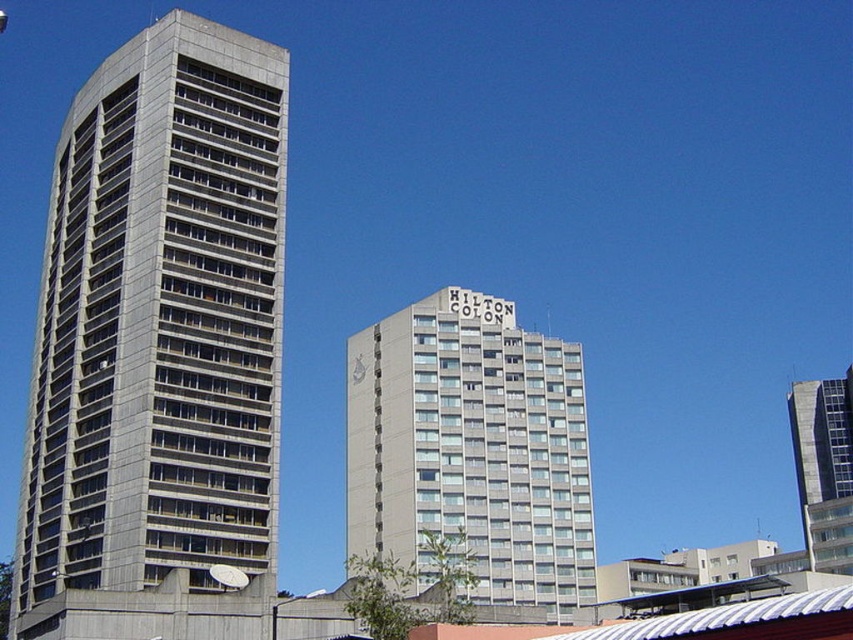
Can you confirm if gray metallic building at left is positioned to the right of gray concrete building at center?

In fact, gray metallic building at left is to the left of gray concrete building at center.

Is point (80, 525) positioned before point (410, 387)?

Yes, it is.

I want to click on gray metallic building at left, so click(x=160, y=321).

Which is more to the left, gray concrete building at center or gray concrete building at right?

gray concrete building at center

Is gray concrete building at center wider than gray concrete building at right?

No.

Is point (422, 492) farther from camera compared to point (816, 536)?

No, (422, 492) is closer to viewer.

You are a GUI agent. You are given a task and a screenshot of the screen. Output one action in this format:
    pyautogui.click(x=<x>, y=<y>)
    Task: Click on the gray concrete building at center
    Image resolution: width=853 pixels, height=640 pixels.
    Given the screenshot: What is the action you would take?
    pyautogui.click(x=471, y=449)

Can you confirm if gray metallic building at left is taller than gray concrete building at right?

Yes, gray metallic building at left is taller than gray concrete building at right.

Who is positioned more to the left, gray metallic building at left or gray concrete building at right?

From the viewer's perspective, gray metallic building at left appears more on the left side.

Between point (212, 120) and point (850, 429), which one is positioned behind?

The point (850, 429) is more distant.

Find the location of a particular element. This screenshot has width=853, height=640. gray metallic building at left is located at coordinates (160, 321).